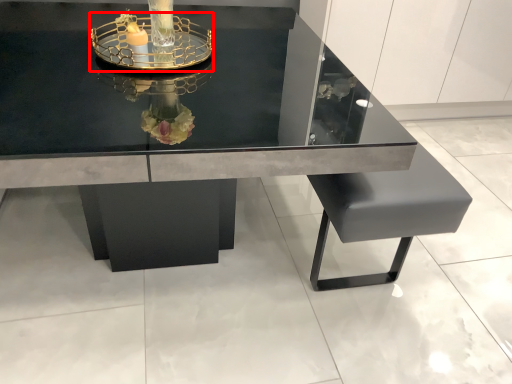
Question: Considering the relative positions of glass box (annotated by the red box) and table in the image provided, where is glass box (annotated by the red box) located with respect to the staircase?

Choices:
 (A) left
 (B) right

Answer: (B)